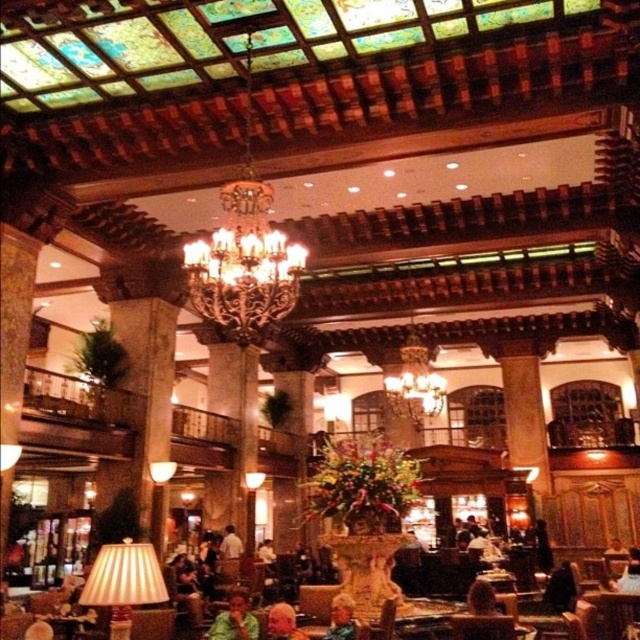
Question: Is green fabric shirt at lower center below dark brown leather jacket at lower right?

Choices:
 (A) yes
 (B) no

Answer: (B)

Question: Which point is closer to the camera?

Choices:
 (A) dark brown leather chair at center
 (B) light brown hair at center
 (C) dark brown leather jacket at lower right
 (D) light brown leather jacket at center

Answer: (B)

Question: Where is brown leather chair at lower center located in relation to light brown leather jacket at center in the image?

Choices:
 (A) left
 (B) right

Answer: (B)

Question: Is dark brown leather chair at center in front of light brown leather jacket at center?

Choices:
 (A) yes
 (B) no

Answer: (A)

Question: Which object appears farthest from the camera in this image?

Choices:
 (A) green fabric shirt at lower center
 (B) golden hair at center

Answer: (A)

Question: Which is nearer to the light brown hair at center?

Choices:
 (A) brown leather chair at lower center
 (B) dark brown leather chair at center
 (C) green fabric shirt at lower center
 (D) dark brown leather jacket at lower right

Answer: (C)